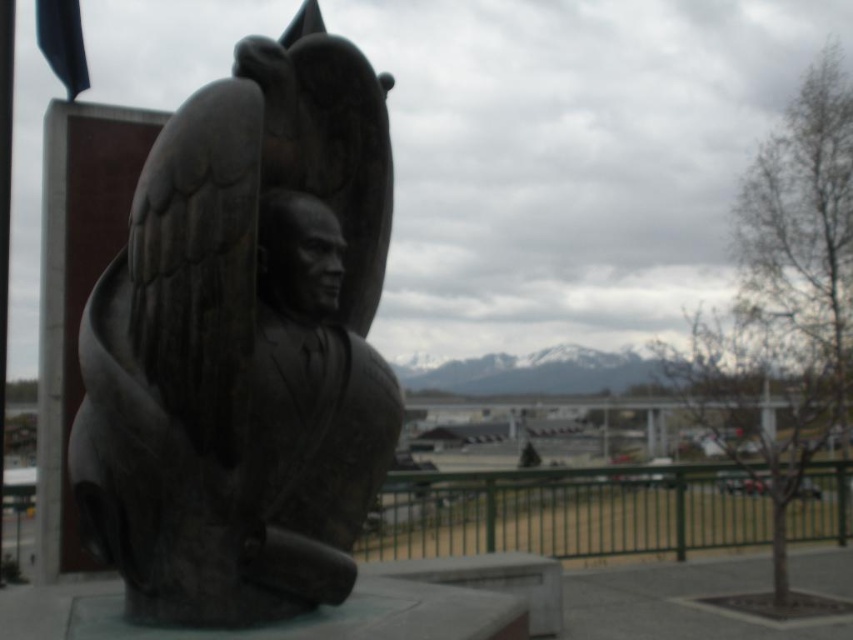
You are standing at the point with coordinates (244, 342) in the image. What object is located exactly at your current position?

The bronze statue at center is located exactly at the point with coordinates (244, 342).

You are standing in front of the bronze statue at center and want to walk towards the green metal fence at lower center. Which direction should you move relative to the statue?

You should move to the right relative to the bronze statue at center because the green metal fence at lower center is located to the right of the statue.

You are a visitor standing at the base of the bronze statue at center. You want to take a photo of the statue without the green metal fence at lower center appearing in the frame. Is the statue positioned in a way that allows you to do this?

The bronze statue at center is located above the green metal fence at lower center, so you can position yourself lower or adjust your angle to frame the statue without the fence obstructing the view.